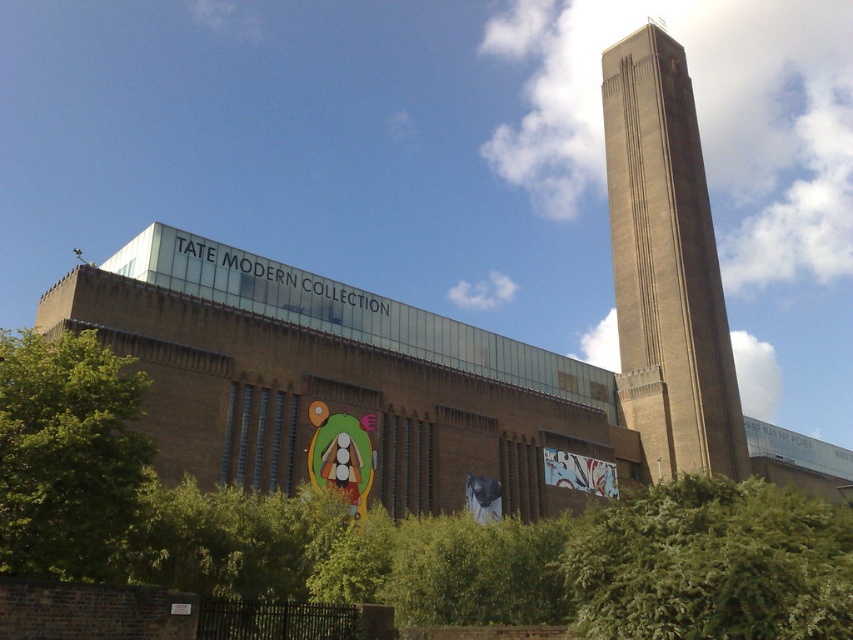
You are a photographer planning to capture the Tate Modern museum with both the brown brick tower at upper right and the green leafy bush at lower right in the frame. Which object should you focus on first if you want to ensure both are in sharp focus?

You should focus on the brown brick tower at upper right first because it is larger than the green leafy bush at lower right, making it easier to achieve sharp focus on the larger object first before adjusting for the smaller one.